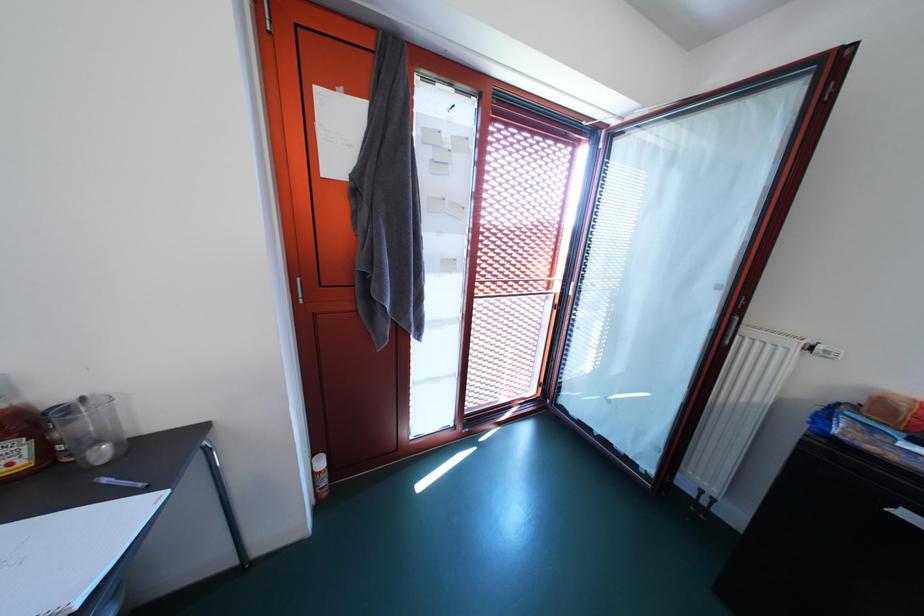
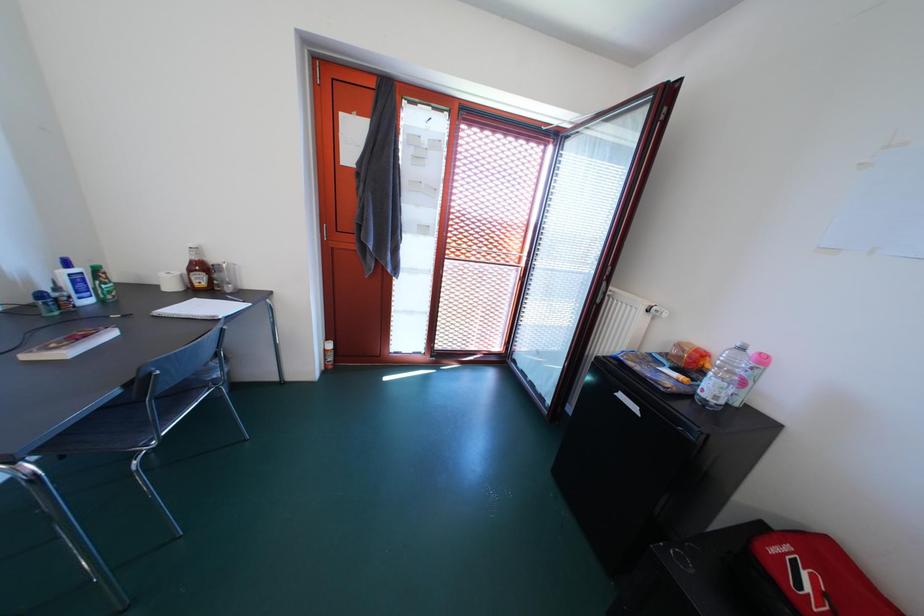
Question: The images are taken continuously from a first-person perspective. In which direction is your viewpoint rotating?

Choices:
 (A) Left
 (B) Right
 (C) Up
 (D) Down

Answer: (A)